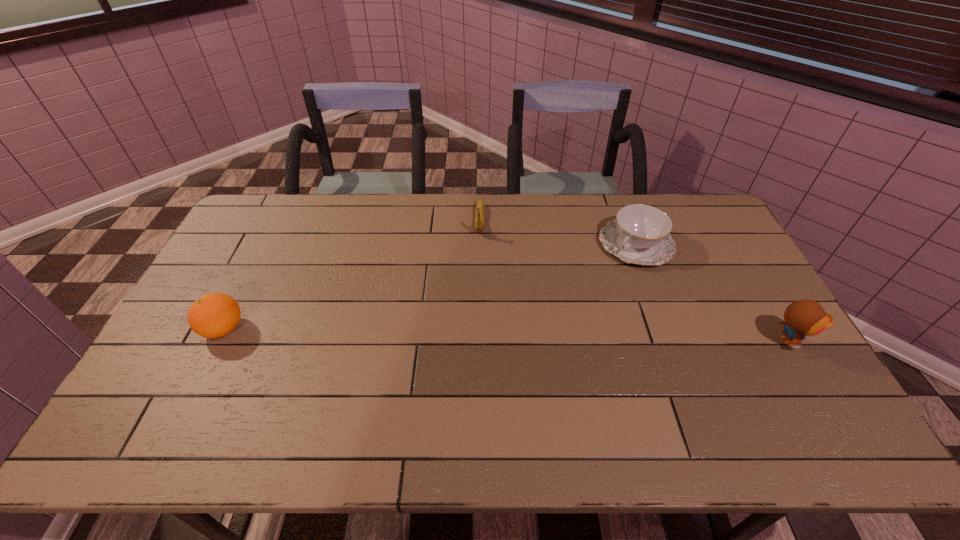
Find the location of `object that stands as the closest to the leftmost object`. object that stands as the closest to the leftmost object is located at coordinates (480, 210).

Where is `object that ranks as the second closest to the chinaware`? This screenshot has height=540, width=960. object that ranks as the second closest to the chinaware is located at coordinates (480, 210).

You are a GUI agent. You are given a task and a screenshot of the screen. Output one action in this format:
    pyautogui.click(x=<x>, y=<y>)
    Task: Click on the free location that satisfies the following two spatial constraints: 1. on the front side of the chinaware; 2. on the front-facing side of the rightmost object
    The width and height of the screenshot is (960, 540).
    Given the screenshot: What is the action you would take?
    pyautogui.click(x=671, y=341)

Find the location of a particular element. vacant space that satisfies the following two spatial constraints: 1. on the front side of the rightmost object; 2. on the front-facing side of the second object from right to left is located at coordinates (671, 341).